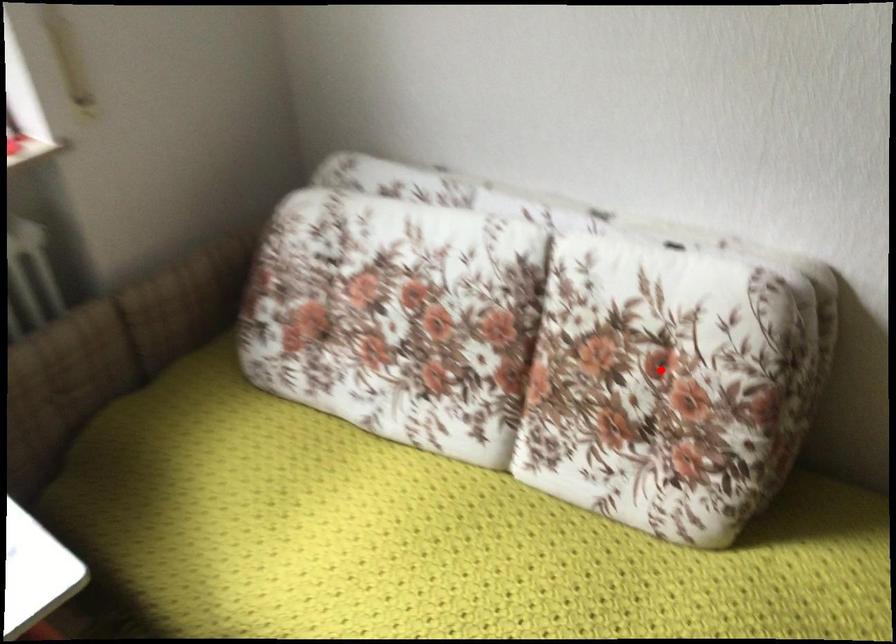
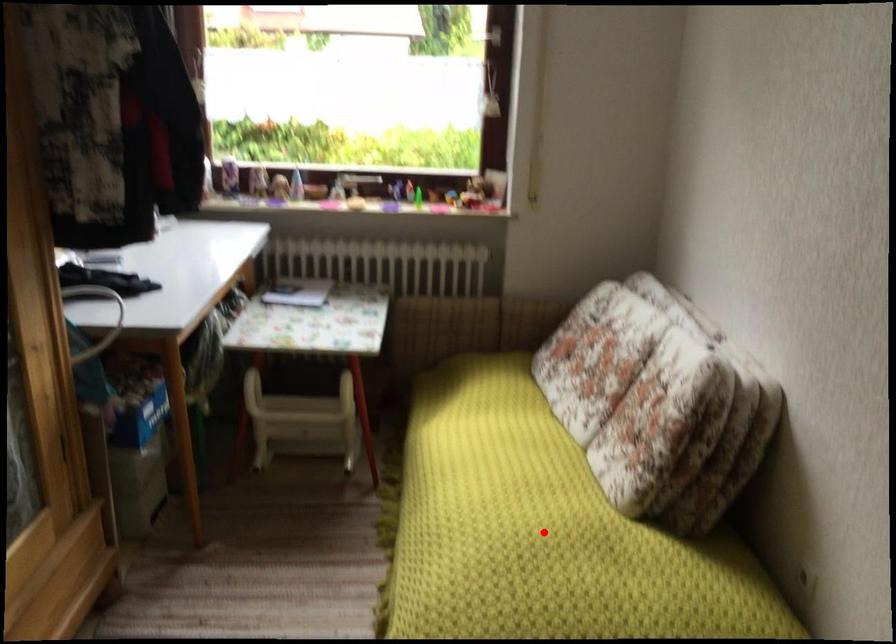
I am providing you with two images of the same scene from different viewpoints. A red point is marked on the first image and another point is marked on the second image. Is the red point in image1 aligned with the point shown in image2?

No